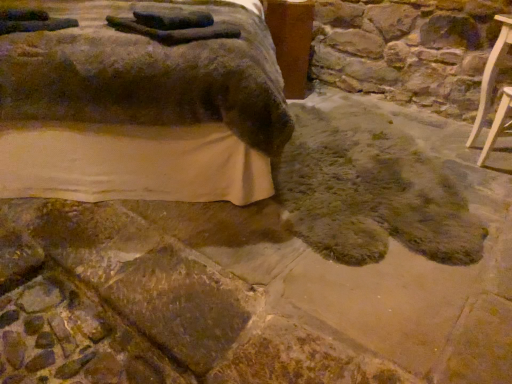
What is the approximate height of fuzzy brown rug at lower center?

2.62 inches.

Identify the location of brown textured mattress at lower left, acting as the first furniture starting from the left. The height and width of the screenshot is (384, 512). (141, 107).

The image size is (512, 384). What do you see at coordinates (141, 107) in the screenshot?
I see `brown textured mattress at lower left, which is the 2th furniture from right to left` at bounding box center [141, 107].

The width and height of the screenshot is (512, 384). In order to click on brown wood table at upper center in this screenshot , I will do `click(291, 41)`.

Between light wood chair at right, the 1th furniture when ordered from right to left, and brown textured mattress at lower left, acting as the first furniture starting from the left, which one appears on the right side from the viewer's perspective?

Positioned to the right is light wood chair at right, the 1th furniture when ordered from right to left.

From the picture: Who is bigger, light wood chair at right, which is the second furniture in left-to-right order, or brown textured mattress at lower left, which is the 2th furniture from right to left?

With larger size is brown textured mattress at lower left, which is the 2th furniture from right to left.

Is light wood chair at right, which is the second furniture in left-to-right order, oriented towards brown textured mattress at lower left, acting as the first furniture starting from the left?

Yes.

From a real-world perspective, is brown wood table at upper center physically above fuzzy brown rug at lower center?

Yes, from a real-world perspective, brown wood table at upper center is over fuzzy brown rug at lower center

Would you consider brown wood table at upper center to be distant from fuzzy brown rug at lower center?

No, brown wood table at upper center is in close proximity to fuzzy brown rug at lower center.

Is the depth of brown wood table at upper center less than that of fuzzy brown rug at lower center?

No, brown wood table at upper center is further to the viewer.

Consider the image. Considering the relative sizes of brown wood table at upper center and light wood chair at right, which is the second furniture in left-to-right order, in the image provided, is brown wood table at upper center bigger than light wood chair at right, which is the second furniture in left-to-right order,?

Yes, brown wood table at upper center is bigger than light wood chair at right, which is the second furniture in left-to-right order.

Considering the sizes of brown wood table at upper center and light wood chair at right, which is the second furniture in left-to-right order, in the image, is brown wood table at upper center taller or shorter than light wood chair at right, which is the second furniture in left-to-right order,?

In the image, brown wood table at upper center appears to be taller than light wood chair at right, which is the second furniture in left-to-right order.

Which is closer to the camera, [296,78] or [497,136]?

Point [296,78] is farther from the camera than point [497,136].

Is brown wood table at upper center facing towards light wood chair at right, which is the second furniture in left-to-right order?

No, brown wood table at upper center is not turned towards light wood chair at right, which is the second furniture in left-to-right order.

Can you see light wood chair at right, which is the second furniture in left-to-right order, touching fuzzy brown rug at lower center?

No, light wood chair at right, which is the second furniture in left-to-right order, is not beside fuzzy brown rug at lower center.

Does light wood chair at right, which is the second furniture in left-to-right order, have a lesser height compared to fuzzy brown rug at lower center?

Incorrect, the height of light wood chair at right, which is the second furniture in left-to-right order, does not fall short of that of fuzzy brown rug at lower center.

From a real-world perspective, between light wood chair at right, the 1th furniture when ordered from right to left, and fuzzy brown rug at lower center, who is vertically higher?

light wood chair at right, the 1th furniture when ordered from right to left, from a real-world perspective.

Is fuzzy brown rug at lower center at the back of light wood chair at right, which is the second furniture in left-to-right order?

light wood chair at right, which is the second furniture in left-to-right order, is not turned away from fuzzy brown rug at lower center.

Considering the sizes of fuzzy brown rug at lower center and brown wood table at upper center in the image, is fuzzy brown rug at lower center taller or shorter than brown wood table at upper center?

fuzzy brown rug at lower center is shorter than brown wood table at upper center.

Considering the points (300, 120) and (280, 27), which point is in front, point (300, 120) or point (280, 27)?

The point (300, 120) is in front.

Is fuzzy brown rug at lower center thinner than brown wood table at upper center?

Incorrect, the width of fuzzy brown rug at lower center is not less than that of brown wood table at upper center.

Would you say fuzzy brown rug at lower center is outside brown wood table at upper center?

fuzzy brown rug at lower center lies outside brown wood table at upper center's area.

Between point (383, 142) and point (94, 30), which one is positioned in front?

Point (94, 30)

From a real-world perspective, is fuzzy brown rug at lower center positioned over brown textured mattress at lower left, acting as the first furniture starting from the left, based on gravity?

Actually, fuzzy brown rug at lower center is physically below brown textured mattress at lower left, acting as the first furniture starting from the left, in the real world.

Is fuzzy brown rug at lower center inside the boundaries of brown textured mattress at lower left, acting as the first furniture starting from the left, or outside?

fuzzy brown rug at lower center lies outside brown textured mattress at lower left, acting as the first furniture starting from the left.

Could you tell me if fuzzy brown rug at lower center is facing brown textured mattress at lower left, acting as the first furniture starting from the left?

No, fuzzy brown rug at lower center is not facing towards brown textured mattress at lower left, acting as the first furniture starting from the left.

Is fuzzy brown rug at lower center positioned with its back to light wood chair at right, the 1th furniture when ordered from right to left?

That's not correct — fuzzy brown rug at lower center is not looking away from light wood chair at right, the 1th furniture when ordered from right to left.

Considering the relative sizes of fuzzy brown rug at lower center and light wood chair at right, the 1th furniture when ordered from right to left, in the image provided, is fuzzy brown rug at lower center wider than light wood chair at right, the 1th furniture when ordered from right to left,?

Yes.

The height and width of the screenshot is (384, 512). Identify the location of furniture lying behind the fuzzy brown rug at lower center. pyautogui.click(x=498, y=124).

Considering the relative positions of fuzzy brown rug at lower center and light wood chair at right, which is the second furniture in left-to-right order, in the image provided, is fuzzy brown rug at lower center to the right of light wood chair at right, which is the second furniture in left-to-right order, from the viewer's perspective?

A: No, fuzzy brown rug at lower center is not to the right of light wood chair at right, which is the second furniture in left-to-right order.

In the image, there is a brown textured mattress at lower left, which is the 2th furniture from right to left. At what (x,y) coordinates should I click in order to perform the action: click on furniture below it (from the image's perspective). Please return your answer as a coordinate pair (x, y). Looking at the image, I should click on (498, 124).

This screenshot has height=384, width=512. In the image, there is a fuzzy brown rug at lower center. In order to click on table above it (from the image's perspective) in this screenshot , I will do `click(291, 41)`.

When comparing their distances from light wood chair at right, the 1th furniture when ordered from right to left, does brown textured mattress at lower left, which is the 2th furniture from right to left, or brown wood table at upper center seem further?

brown textured mattress at lower left, which is the 2th furniture from right to left, lies further to light wood chair at right, the 1th furniture when ordered from right to left, than the other object.

Looking at this image, estimate the real-world distances between objects in this image. Which object is further from brown wood table at upper center, light wood chair at right, which is the second furniture in left-to-right order, or brown textured mattress at lower left, acting as the first furniture starting from the left?

light wood chair at right, which is the second furniture in left-to-right order, is positioned further to the anchor brown wood table at upper center.

Which object lies further to the anchor point light wood chair at right, which is the second furniture in left-to-right order, brown wood table at upper center or fuzzy brown rug at lower center?

The object further to light wood chair at right, which is the second furniture in left-to-right order, is brown wood table at upper center.

Which object lies nearer to the anchor point fuzzy brown rug at lower center, brown textured mattress at lower left, acting as the first furniture starting from the left, or light wood chair at right, which is the second furniture in left-to-right order?

The object closer to fuzzy brown rug at lower center is light wood chair at right, which is the second furniture in left-to-right order.

Based on their spatial positions, is brown textured mattress at lower left, which is the 2th furniture from right to left, or light wood chair at right, the 1th furniture when ordered from right to left, closer to brown wood table at upper center?

brown textured mattress at lower left, which is the 2th furniture from right to left.

From the image, which object appears to be nearer to brown wood table at upper center, fuzzy brown rug at lower center or brown textured mattress at lower left, which is the 2th furniture from right to left?

The object closer to brown wood table at upper center is fuzzy brown rug at lower center.

Considering their positions, is light wood chair at right, which is the second furniture in left-to-right order, positioned closer to fuzzy brown rug at lower center than brown wood table at upper center?

The object closer to fuzzy brown rug at lower center is light wood chair at right, which is the second furniture in left-to-right order.

Looking at the image, which one is located further to fuzzy brown rug at lower center, brown wood table at upper center or light wood chair at right, which is the second furniture in left-to-right order?

Based on the image, brown wood table at upper center appears to be further to fuzzy brown rug at lower center.

The height and width of the screenshot is (384, 512). Identify the location of furniture between fuzzy brown rug at lower center and brown wood table at upper center along the z-axis. (498, 124).

Locate an element on the screen. This screenshot has height=384, width=512. table situated between brown textured mattress at lower left, which is the 2th furniture from right to left, and light wood chair at right, the 1th furniture when ordered from right to left, from left to right is located at coordinates (291, 41).

At what (x,y) coordinates should I click in order to perform the action: click on footprint located between brown textured mattress at lower left, acting as the first furniture starting from the left, and light wood chair at right, the 1th furniture when ordered from right to left, in the left-right direction. Please return your answer as a coordinate pair (x, y). Image resolution: width=512 pixels, height=384 pixels. Looking at the image, I should click on (371, 190).

What are the coordinates of `footprint between brown textured mattress at lower left, which is the 2th furniture from right to left, and brown wood table at upper center, along the z-axis` in the screenshot? It's located at (371, 190).